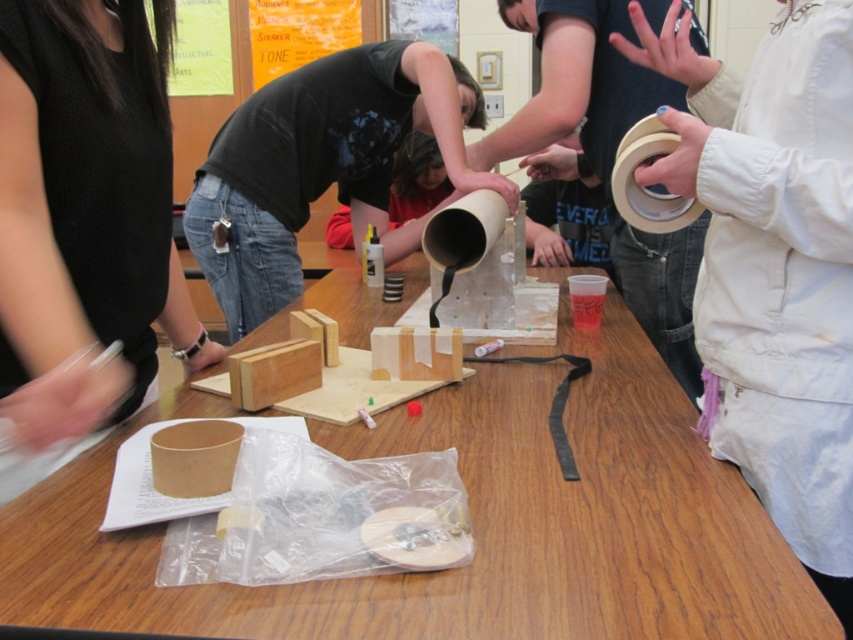
Question: Can you confirm if wooden table at center is positioned to the left of black matte shirt at center?

Choices:
 (A) no
 (B) yes

Answer: (A)

Question: Which object is closer to the camera taking this photo?

Choices:
 (A) black matte shirt at center
 (B) wooden table at center

Answer: (B)

Question: Which point is closer to the camera taking this photo?

Choices:
 (A) (283, 106)
 (B) (97, 621)

Answer: (B)

Question: Can you confirm if wooden table at center is wider than black matte shirt at center?

Choices:
 (A) no
 (B) yes

Answer: (B)

Question: Does wooden table at center appear on the right side of black matte shirt at center?

Choices:
 (A) yes
 (B) no

Answer: (A)

Question: Which point is farther to the camera?

Choices:
 (A) black matte shirt at center
 (B) wooden table at center

Answer: (A)